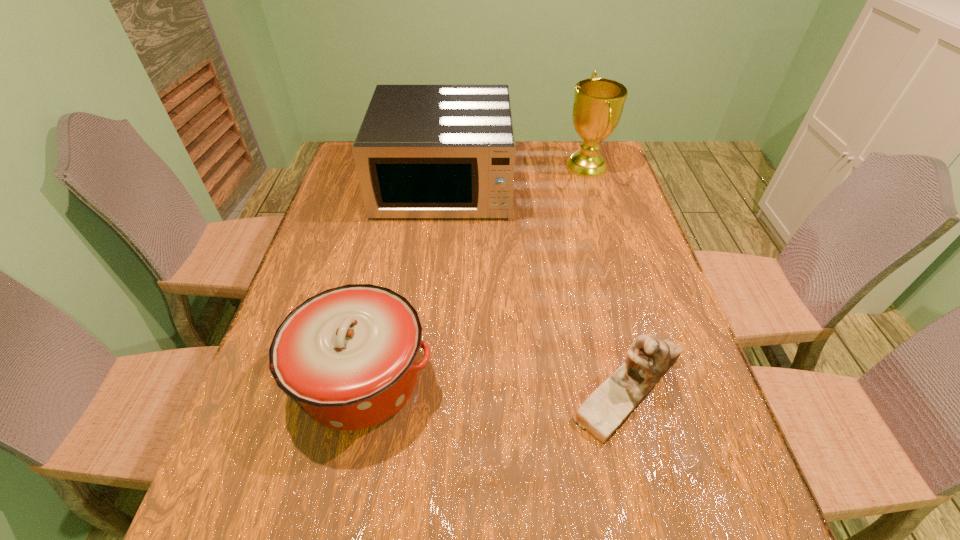
Find the location of `vacant space situated 0.370m on the front-facing side of the figurine`. vacant space situated 0.370m on the front-facing side of the figurine is located at coordinates (389, 388).

Locate an element on the screen. The width and height of the screenshot is (960, 540). free region located on the front-facing side of the figurine is located at coordinates (427, 388).

Where is `award that is at the far edge`? This screenshot has width=960, height=540. award that is at the far edge is located at coordinates (598, 104).

Locate an element on the screen. The width and height of the screenshot is (960, 540). microwave oven present at the far edge is located at coordinates (422, 151).

At what (x,y) coordinates should I click in order to perform the action: click on microwave oven located in the left edge section of the desktop. Please return your answer as a coordinate pair (x, y). The width and height of the screenshot is (960, 540). Looking at the image, I should click on (422, 151).

Where is `casserole present at the left edge`? casserole present at the left edge is located at coordinates (349, 354).

Where is `award that is at the right edge`? award that is at the right edge is located at coordinates (598, 104).

This screenshot has height=540, width=960. Find the location of `figurine located in the right edge section of the desktop`. figurine located in the right edge section of the desktop is located at coordinates (648, 359).

This screenshot has width=960, height=540. Find the location of `object that is at the far left corner`. object that is at the far left corner is located at coordinates (422, 151).

I want to click on object that is at the far right corner, so click(598, 104).